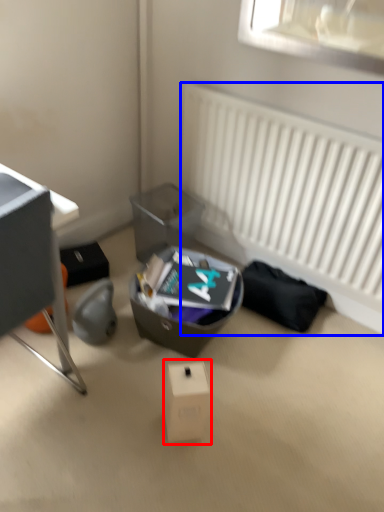
Question: Which of the following is the closest to the observer, cardboard box (highlighted by a red box) or radiator (highlighted by a blue box)?

Choices:
 (A) cardboard box
 (B) radiator

Answer: (A)